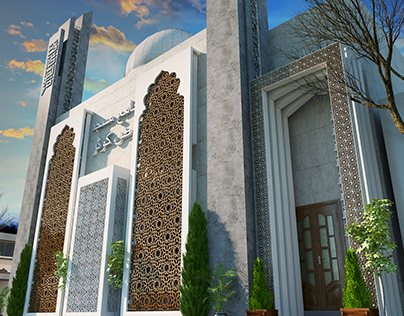
Locate an element on the screen. This screenshot has width=404, height=316. plant pots is located at coordinates (357, 313), (265, 313).